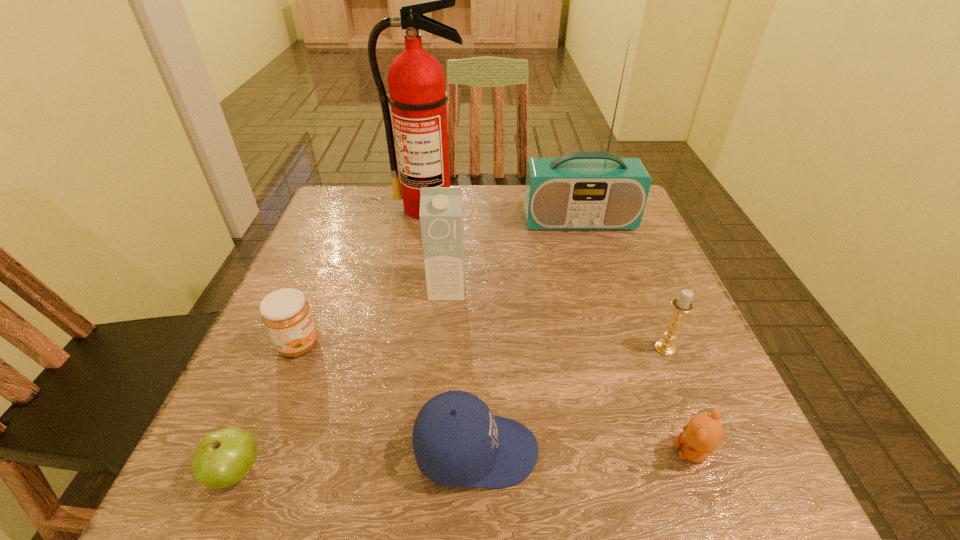
Locate an element on the screen. This screenshot has width=960, height=540. object that is at the far right corner is located at coordinates 580,190.

The image size is (960, 540). In order to click on object that is positioned at the near right corner in this screenshot , I will do `click(703, 434)`.

Where is `free spot at the far edge of the desktop`? free spot at the far edge of the desktop is located at coordinates (x=471, y=234).

The width and height of the screenshot is (960, 540). I want to click on free spot at the left edge of the desktop, so click(x=229, y=394).

Find the location of a particular element. This screenshot has height=540, width=960. vacant space at the right edge of the desktop is located at coordinates coord(659,255).

This screenshot has height=540, width=960. Find the location of `vacant space at the far left corner of the desktop`. vacant space at the far left corner of the desktop is located at coordinates (317, 232).

Locate an element on the screen. This screenshot has width=960, height=540. vacant space at the near left corner of the desktop is located at coordinates coord(300,464).

Identify the location of free space at the near right corner of the desktop. The height and width of the screenshot is (540, 960). (690, 479).

Where is `free space that is in between the cap and the apple`? free space that is in between the cap and the apple is located at coordinates pos(356,461).

This screenshot has height=540, width=960. In order to click on free area in between the sixth shortest object and the seventh shortest object in this screenshot , I will do `click(514, 255)`.